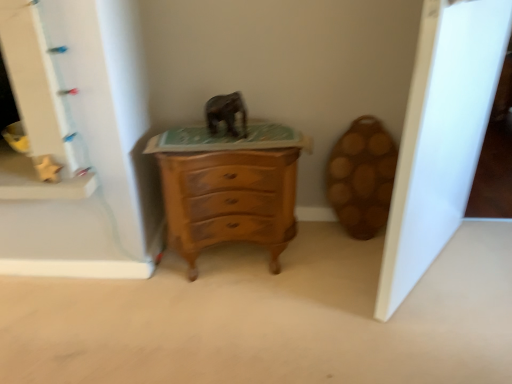
Question: From the image's perspective, is white glossy door at right positioned above or below matte gray elephant at center?

Choices:
 (A) below
 (B) above

Answer: (A)

Question: Looking at their shapes, would you say white glossy door at right is wider or thinner than matte gray elephant at center?

Choices:
 (A) wide
 (B) thin

Answer: (A)

Question: Which object is the closest to the white glossy door at right?

Choices:
 (A) matte gray elephant at center
 (B) wooden chest of drawers at center

Answer: (B)

Question: Based on their relative distances, which object is farther from the white glossy door at right?

Choices:
 (A) matte gray elephant at center
 (B) wooden chest of drawers at center

Answer: (A)